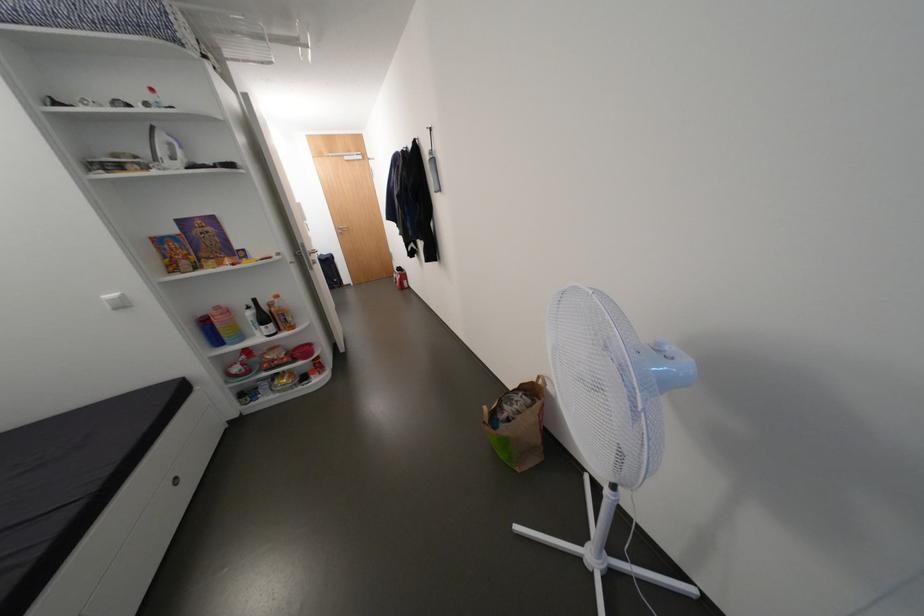
This screenshot has height=616, width=924. Identify the location of metal wall hook. (432, 163).